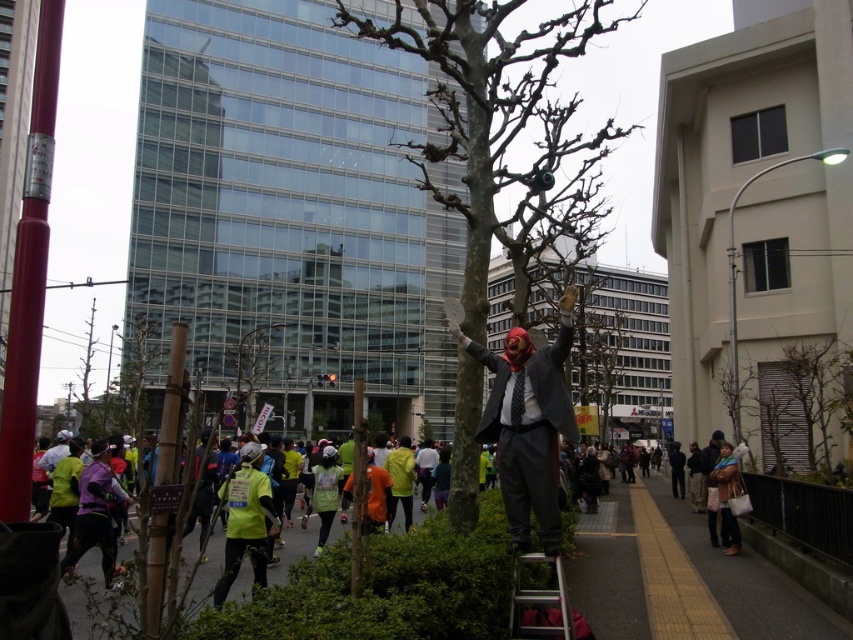
Question: Does bare wood tree at center appear under matte black suit at center?

Choices:
 (A) yes
 (B) no

Answer: (B)

Question: Which point is farther from the camera taking this photo?

Choices:
 (A) (466, 328)
 (B) (538, 596)

Answer: (A)

Question: Is bare wood tree at center further to the viewer compared to matte black suit at center?

Choices:
 (A) no
 (B) yes

Answer: (B)

Question: Which point appears closest to the camera in this image?

Choices:
 (A) (523, 525)
 (B) (561, 625)
 (C) (476, 298)

Answer: (B)

Question: Which point is farther from the camera taking this photo?

Choices:
 (A) (567, 625)
 (B) (476, 243)

Answer: (B)

Question: Is bare wood tree at center to the right of matte black suit at center from the viewer's perspective?

Choices:
 (A) no
 (B) yes

Answer: (B)